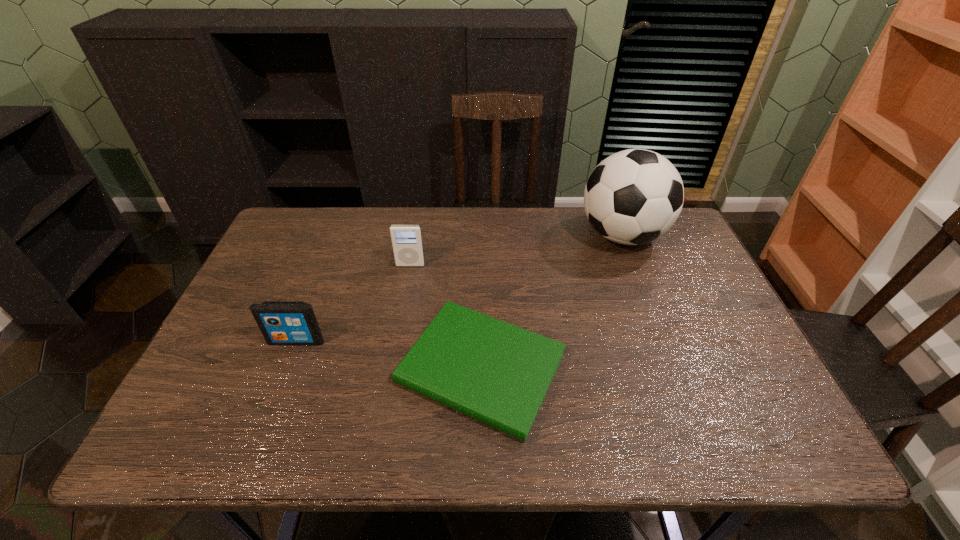
At what (x,y) coordinates should I click in order to perform the action: click on free location at the near right corner. Please return your answer as a coordinate pair (x, y). Looking at the image, I should click on (746, 414).

Where is `free point between the right iPod and the rightmost object`? free point between the right iPod and the rightmost object is located at coordinates (516, 250).

Where is `vacant point located between the leftmost object and the right iPod`? vacant point located between the leftmost object and the right iPod is located at coordinates (353, 303).

Locate an element on the screen. This screenshot has height=540, width=960. vacant point located between the nearer iPod and the soccer ball is located at coordinates (459, 288).

Locate an element on the screen. vacant region between the right iPod and the soccer ball is located at coordinates (516, 250).

The image size is (960, 540). What are the coordinates of `vacant space that's between the nearer iPod and the rightmost object` in the screenshot? It's located at (459, 288).

The image size is (960, 540). Find the location of `free space between the leftmost object and the soccer ball`. free space between the leftmost object and the soccer ball is located at coordinates (459, 288).

Identify the location of free space between the nearer iPod and the right iPod. This screenshot has height=540, width=960. (353, 303).

Where is `vacant area that lies between the right iPod and the nearer iPod`? The image size is (960, 540). vacant area that lies between the right iPod and the nearer iPod is located at coordinates (353, 303).

I want to click on object that is the second nearest to the shortest object, so pyautogui.click(x=281, y=322).